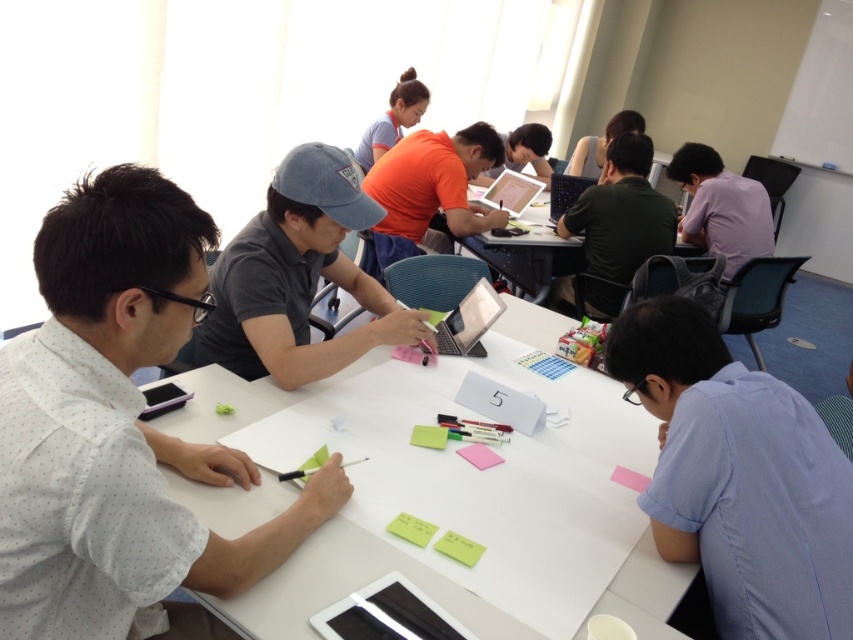
Can you confirm if dark green shirt at center is positioned above green matte sticky note at center?

Yes.

Between dark green shirt at center and green matte sticky note at center, which one has less height?

green matte sticky note at center

Find the location of a particular element. dark green shirt at center is located at coordinates tap(621, 212).

Find the location of a particular element. dark green shirt at center is located at coordinates (621, 212).

Who is taller, matte black laptop at center or green matte sticky note at center?

matte black laptop at center

Can you confirm if matte black laptop at center is taller than green matte sticky note at center?

Yes.

Which is behind, point (506, 195) or point (439, 444)?

Positioned behind is point (506, 195).

You are a GUI agent. You are given a task and a screenshot of the screen. Output one action in this format:
    pyautogui.click(x=<x>, y=<y>)
    Task: Click on the matte black laptop at center
    
    Given the screenshot: What is the action you would take?
    coord(511,193)

Who is more forward, (99, 301) or (549, 208)?

Point (99, 301) is in front.

Between white dotted shirt at left and satin black laptop at center, which one is positioned higher?

Positioned higher is satin black laptop at center.

Is point (93, 272) positioned in front of point (561, 176)?

That is True.

What are the coordinates of `white dotted shirt at left` in the screenshot? It's located at (119, 428).